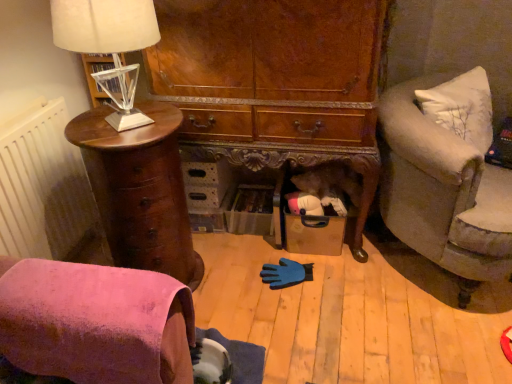
Where is `empty space that is ontop of pink suede chair at lower left (from a real-world perspective)`? empty space that is ontop of pink suede chair at lower left (from a real-world perspective) is located at coordinates (83, 286).